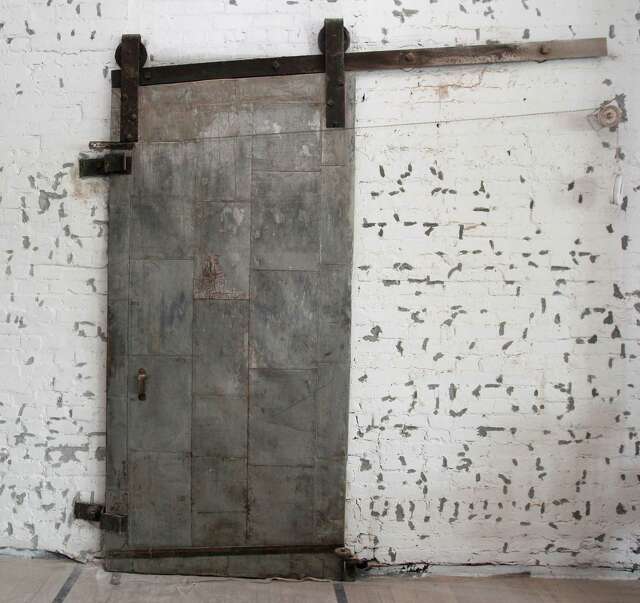
You are a GUI agent. You are given a task and a screenshot of the screen. Output one action in this format:
    pyautogui.click(x=<x>, y=<y>)
    Task: Click on the brick wall
    
    Given the screenshot: What is the action you would take?
    pyautogui.click(x=548, y=156)